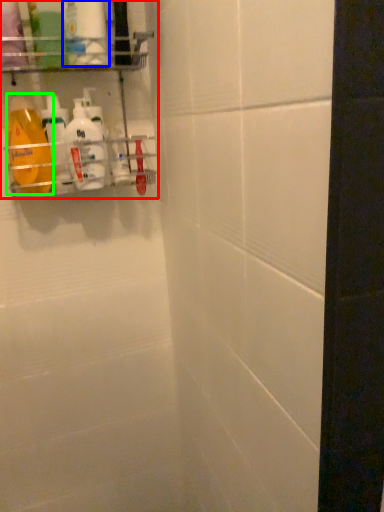
Question: Considering the real-world distances, which object is closest to shelf (highlighted by a red box)? cleaning product (highlighted by a blue box) or cleaning product (highlighted by a green box).

Choices:
 (A) cleaning product
 (B) cleaning product

Answer: (B)